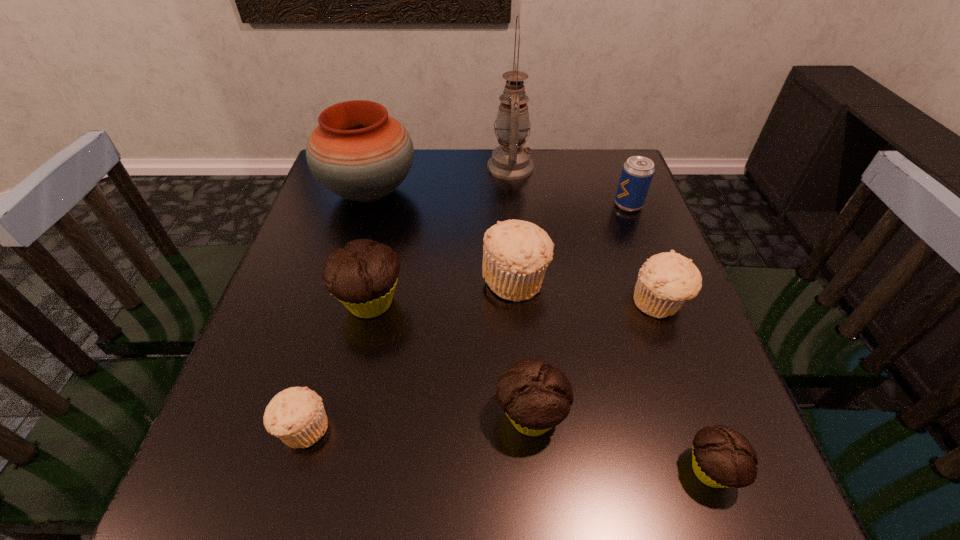
I want to click on free space between the rightmost beige muffin and the rightmost chocolate muffin, so click(685, 387).

Locate an element on the screen. vacant space in between the leftmost beige muffin and the second beige muffin from right to left is located at coordinates (410, 354).

At what (x,y) coordinates should I click in order to perform the action: click on vacant space that's between the second chocolate muffin from left to right and the beer can. Please return your answer as a coordinate pair (x, y). The height and width of the screenshot is (540, 960). Looking at the image, I should click on (580, 310).

Where is `vacant area that lies between the nearest beige muffin and the smallest chocolate muffin`? The height and width of the screenshot is (540, 960). vacant area that lies between the nearest beige muffin and the smallest chocolate muffin is located at coordinates (507, 449).

Identify which object is the sixth nearest to the beer can. Please provide its 2D coordinates. Your answer should be formatted as a tuple, i.e. [(x, y)], where the tuple contains the x and y coordinates of a point satisfying the conditions above.

[(363, 275)]

Identify which object is the eighth nearest to the rightmost chocolate muffin. Please provide its 2D coordinates. Your answer should be formatted as a tuple, i.e. [(x, y)], where the tuple contains the x and y coordinates of a point satisfying the conditions above.

[(510, 161)]

Locate which muffin is the third closest to the biggest chocolate muffin. Please provide its 2D coordinates. Your answer should be formatted as a tuple, i.e. [(x, y)], where the tuple contains the x and y coordinates of a point satisfying the conditions above.

[(536, 397)]

Locate which muffin is the second closest to the gray oil lamp. Please provide its 2D coordinates. Your answer should be formatted as a tuple, i.e. [(x, y)], where the tuple contains the x and y coordinates of a point satisfying the conditions above.

[(363, 275)]

Where is `beige muffin that is the third closest one to the smallest chocolate muffin`? The height and width of the screenshot is (540, 960). beige muffin that is the third closest one to the smallest chocolate muffin is located at coordinates (296, 415).

I want to click on beige muffin that is the second closest to the smallest beige muffin, so click(666, 280).